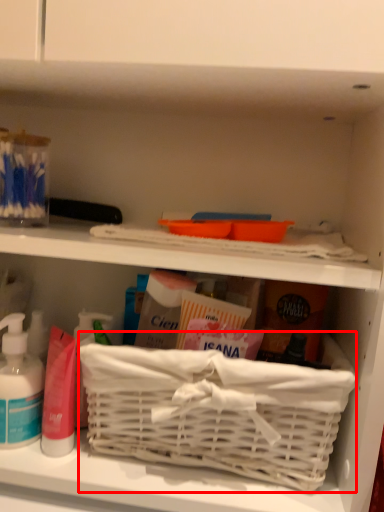
Question: From the image's perspective, where is basket container (annotated by the red box) located relative to cleaning product?

Choices:
 (A) below
 (B) above

Answer: (A)